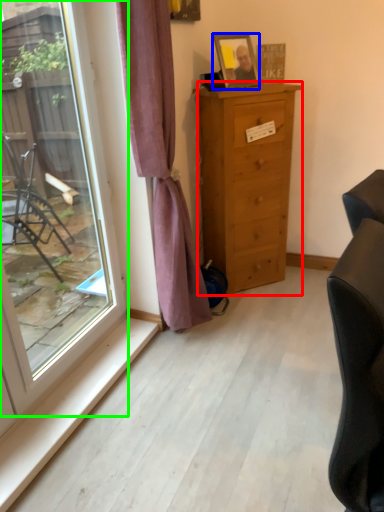
Question: Based on their relative distances, which object is farther from chest of drawers (highlighted by a red box)? Choose from picture frame (highlighted by a blue box) and window (highlighted by a green box).

Choices:
 (A) picture frame
 (B) window

Answer: (B)